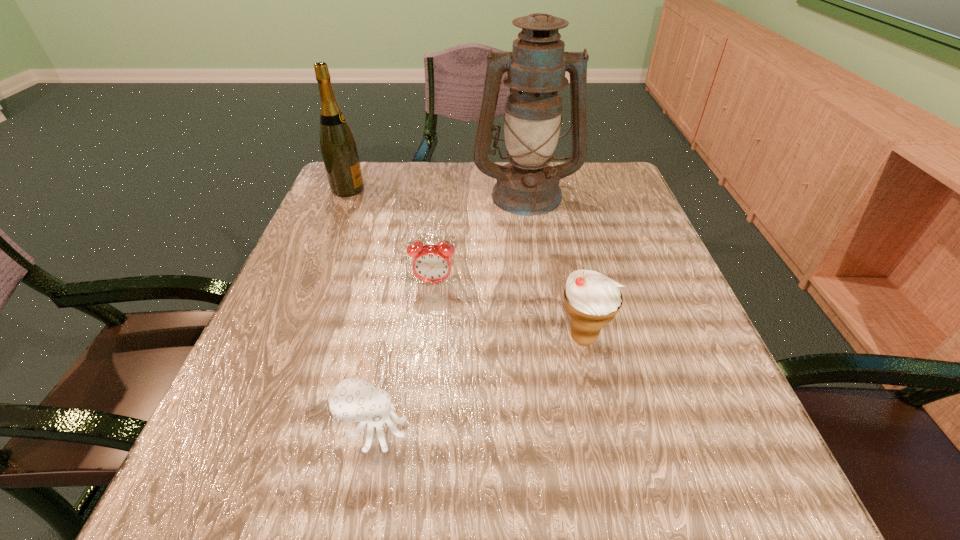
Identify the location of free space that satisfies the following two spatial constraints: 1. on the back side of the third tallest object; 2. on the front-facing side of the leftmost object. Image resolution: width=960 pixels, height=540 pixels. (550, 189).

Where is `vacant space that satisfies the following two spatial constraints: 1. on the face of the icecream; 2. on the left side of the alarm clock`? vacant space that satisfies the following two spatial constraints: 1. on the face of the icecream; 2. on the left side of the alarm clock is located at coordinates (427, 338).